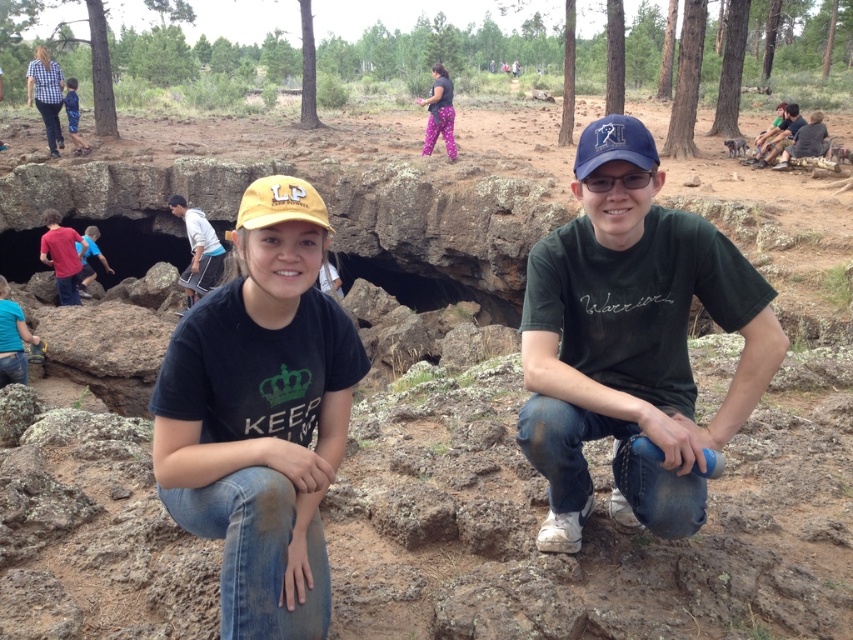
Which is in front, point (585, 168) or point (88, 236)?

Point (585, 168) is more forward.

Who is shorter, blue fabric baseball cap at center or blue shirt at lower left?

blue shirt at lower left is shorter.

Is point (598, 122) closer to camera compared to point (90, 273)?

Yes, it is in front of point (90, 273).

Where is `blue fabric baseball cap at center`? The height and width of the screenshot is (640, 853). blue fabric baseball cap at center is located at coordinates (614, 145).

Does point (262, 212) come closer to viewer compared to point (592, 164)?

Yes, it is.

How much distance is there between yellow fabric baseball cap at center and blue fabric baseball cap at center?

A distance of 4.01 meters exists between yellow fabric baseball cap at center and blue fabric baseball cap at center.

What do you see at coordinates (280, 204) in the screenshot? This screenshot has width=853, height=640. I see `yellow fabric baseball cap at center` at bounding box center [280, 204].

This screenshot has width=853, height=640. What are the coordinates of `yellow fabric baseball cap at center` in the screenshot? It's located at (280, 204).

What do you see at coordinates (260, 416) in the screenshot? This screenshot has height=640, width=853. I see `black matte t-shirt at center` at bounding box center [260, 416].

In order to click on black matte t-shirt at center in this screenshot , I will do `click(260, 416)`.